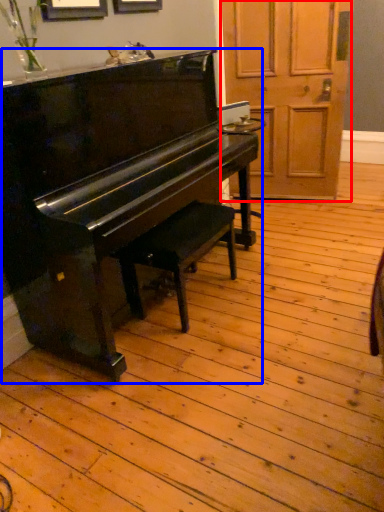
Question: Which object is further to the camera taking this photo, screen door (highlighted by a red box) or piano (highlighted by a blue box)?

Choices:
 (A) screen door
 (B) piano

Answer: (A)